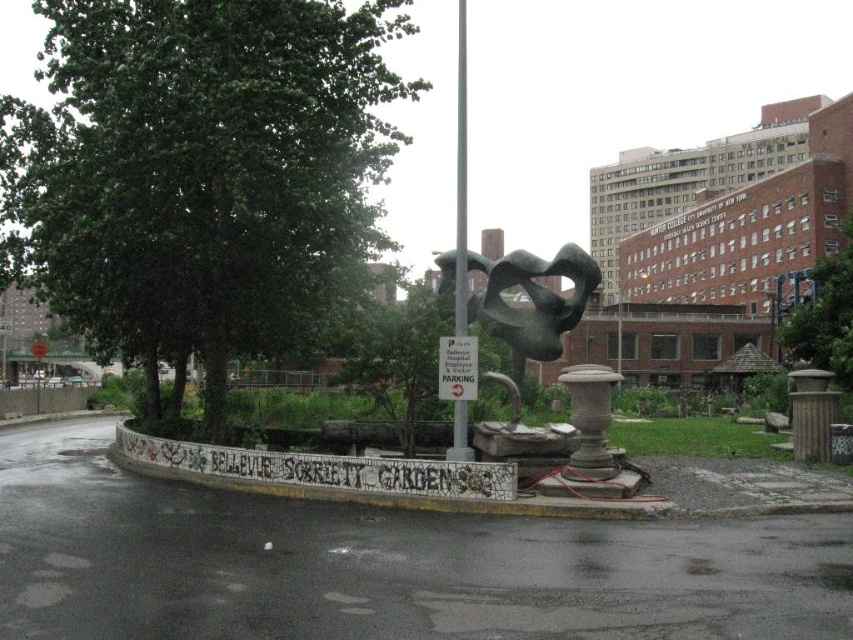
Is point (544, 301) closer to viewer compared to point (463, 168)?

No, it is not.

Can you confirm if bronze abstract sculpture at center is thinner than silver metallic pole at center?

No, bronze abstract sculpture at center is not thinner than silver metallic pole at center.

Where is `bronze abstract sculpture at center`? The image size is (853, 640). bronze abstract sculpture at center is located at coordinates (532, 300).

Who is positioned more to the left, green leafy tree at center or green leafy tree at upper right?

Positioned to the left is green leafy tree at center.

Which is behind, point (311, 76) or point (791, 333)?

The point (791, 333) is more distant.

The width and height of the screenshot is (853, 640). I want to click on green leafy tree at center, so click(x=201, y=173).

Which is more to the left, green leafy tree at center or metallic pole at center?

green leafy tree at center

Is green leafy tree at center below metallic pole at center?

Actually, green leafy tree at center is above metallic pole at center.

Is point (84, 177) farther from camera compared to point (616, 308)?

No, it is in front of (616, 308).

Where is `green leafy tree at center`? The image size is (853, 640). green leafy tree at center is located at coordinates (201, 173).